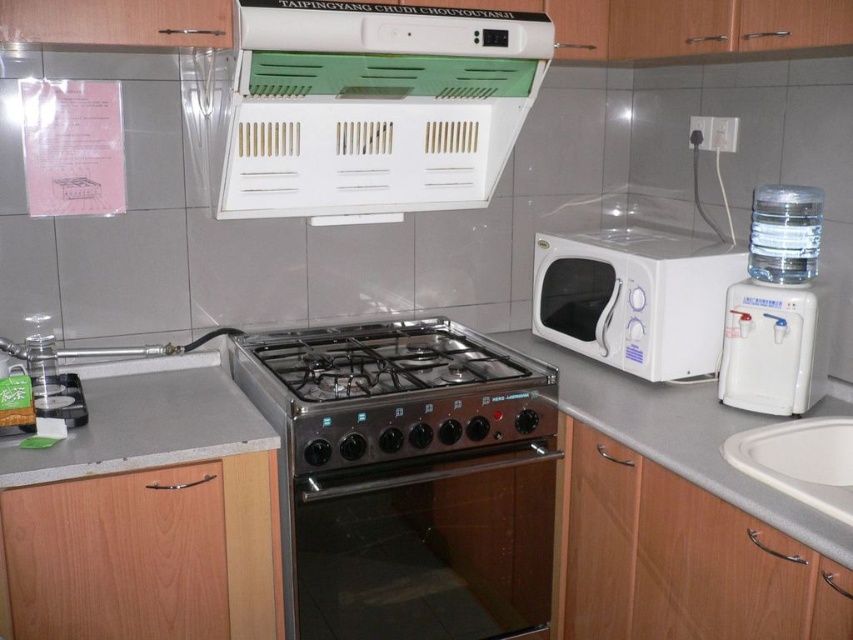
Describe the element at coordinates (407, 477) in the screenshot. The height and width of the screenshot is (640, 853). I see `stainless steel oven at center` at that location.

Is stainless steel oven at center thinner than gray laminate counter at center?

Incorrect, stainless steel oven at center's width is not less than gray laminate counter at center's.

Does point (445, 372) come behind point (675, 461)?

Yes, point (445, 372) is farther from viewer.

Where is `stainless steel oven at center`? stainless steel oven at center is located at coordinates (407, 477).

Who is more forward, [332,433] or [799,232]?

Point [332,433]

Is stainless steel gas stove at center to the right of clear plastic water filter at upper right from the viewer's perspective?

Incorrect, stainless steel gas stove at center is not on the right side of clear plastic water filter at upper right.

Identify the location of stainless steel gas stove at center. This screenshot has height=640, width=853. (392, 392).

Who is more forward, (276, 332) or (73, 472)?

Positioned in front is point (73, 472).

From the picture: Is stainless steel gas stove at center further to the viewer compared to gray matte countertop at center?

Yes, it is behind gray matte countertop at center.

Who is more forward, (548,410) or (218,436)?

Point (218,436) is more forward.

Locate an element on the screen. This screenshot has width=853, height=640. stainless steel gas stove at center is located at coordinates (392, 392).